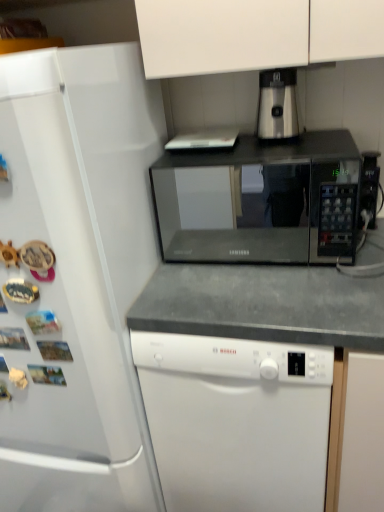
Question: Should I look upward or downward to see white matte dishwasher at center?

Choices:
 (A) down
 (B) up

Answer: (A)

Question: Is satin silver coffee machine at upper center looking in the opposite direction of white matte dishwasher at center?

Choices:
 (A) yes
 (B) no

Answer: (B)

Question: From a real-world perspective, is satin silver coffee machine at upper center beneath white matte dishwasher at center?

Choices:
 (A) yes
 (B) no

Answer: (B)

Question: Is white matte dishwasher at center surrounded by satin silver coffee machine at upper center?

Choices:
 (A) yes
 (B) no

Answer: (B)

Question: Is satin silver coffee machine at upper center with white matte dishwasher at center?

Choices:
 (A) yes
 (B) no

Answer: (B)

Question: Is satin silver coffee machine at upper center shorter than white matte dishwasher at center?

Choices:
 (A) yes
 (B) no

Answer: (A)

Question: From a real-world perspective, is satin silver coffee machine at upper center physically above white matte dishwasher at center?

Choices:
 (A) no
 (B) yes

Answer: (B)

Question: From the image's perspective, would you say white glossy refrigerator at left is shown under black matte microwave at center?

Choices:
 (A) no
 (B) yes

Answer: (B)

Question: From a real-world perspective, is white glossy refrigerator at left physically above black matte microwave at center?

Choices:
 (A) no
 (B) yes

Answer: (A)

Question: Can you confirm if white glossy refrigerator at left is taller than black matte microwave at center?

Choices:
 (A) yes
 (B) no

Answer: (A)

Question: From a real-world perspective, is white glossy refrigerator at left beneath black matte microwave at center?

Choices:
 (A) yes
 (B) no

Answer: (A)

Question: Does white glossy refrigerator at left have a larger size compared to black matte microwave at center?

Choices:
 (A) no
 (B) yes

Answer: (B)

Question: Could you tell me if white glossy refrigerator at left is facing black matte microwave at center?

Choices:
 (A) no
 (B) yes

Answer: (A)

Question: Is satin silver coffee machine at upper center thinner than black matte microwave at center?

Choices:
 (A) yes
 (B) no

Answer: (A)